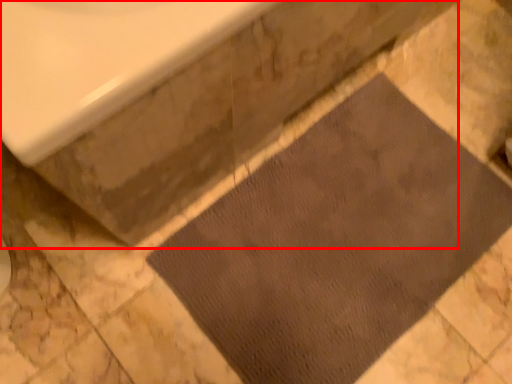
Question: From the image's perspective, what is the correct spatial positioning of bath (annotated by the red box) in reference to doormat?

Choices:
 (A) above
 (B) below

Answer: (A)